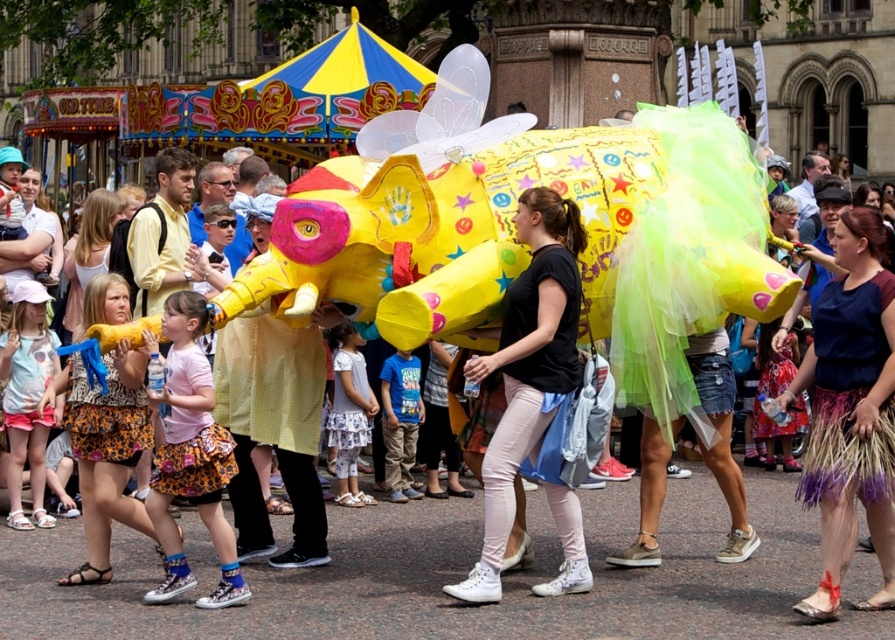
Who is positioned more to the right, pink fabric skirt at center or blue cotton shirt at center?

From the viewer's perspective, blue cotton shirt at center appears more on the right side.

Between pink fabric skirt at center and blue cotton shirt at center, which one has less height?

Standing shorter between the two is pink fabric skirt at center.

Does point (166, 376) lie in front of point (388, 458)?

Yes.

Locate an element on the screen. This screenshot has height=640, width=895. pink fabric skirt at center is located at coordinates (192, 456).

Which is more to the left, light pink cotton shirt at center or blue cotton shirt at center?

Positioned to the left is light pink cotton shirt at center.

Can you confirm if light pink cotton shirt at center is taller than blue cotton shirt at center?

Correct, light pink cotton shirt at center is much taller as blue cotton shirt at center.

Which is in front, point (23, 417) or point (386, 481)?

Point (23, 417) is in front.

Where is `light pink cotton shirt at center`? This screenshot has height=640, width=895. light pink cotton shirt at center is located at coordinates (27, 397).

Consider the image. Can you confirm if straw skirt at center is wider than blue cotton shirt at center?

Indeed, straw skirt at center has a greater width compared to blue cotton shirt at center.

Does straw skirt at center have a larger size compared to blue cotton shirt at center?

Indeed, straw skirt at center has a larger size compared to blue cotton shirt at center.

Where is `straw skirt at center`? straw skirt at center is located at coordinates (851, 410).

Where is `straw skirt at center`? straw skirt at center is located at coordinates (851, 410).